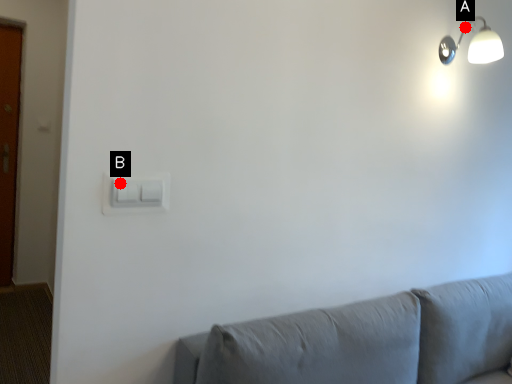
Question: Two points are circled on the image, labeled by A and B beside each circle. Which point is further to the camera?

Choices:
 (A) A is further
 (B) B is further

Answer: (A)